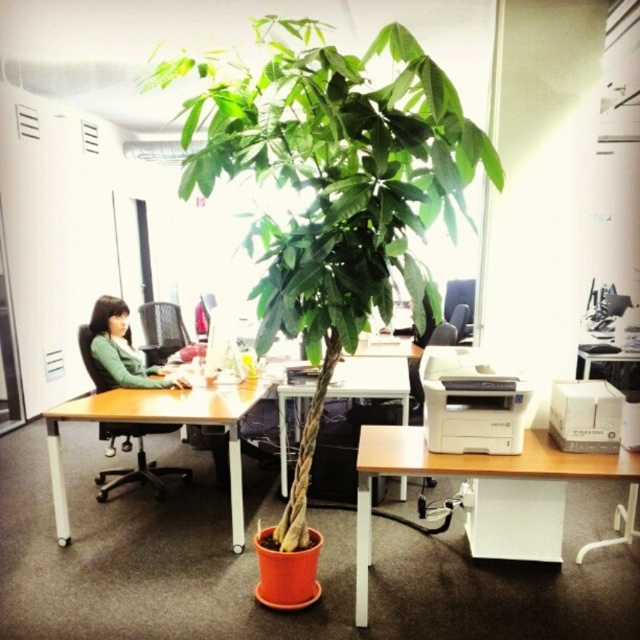
Who is more forward, [608,467] or [241,404]?

Point [608,467] is more forward.

Can you confirm if white plastic printer at lower center is wider than wooden table at center?

In fact, white plastic printer at lower center might be narrower than wooden table at center.

Is point (358, 579) farther from viewer compared to point (228, 474)?

No, it is not.

Where is `white plastic printer at lower center`? This screenshot has height=640, width=640. white plastic printer at lower center is located at coordinates (461, 476).

Is point (275, 122) positioned after point (90, 348)?

That is False.

Which is in front, point (440, 97) or point (99, 348)?

Point (440, 97) is more forward.

Identify the location of green leafy plant at center. The height and width of the screenshot is (640, 640). (332, 188).

Is the position of green leafy plant at center more distant than that of white matte printer at right?

No.

Measure the distance between green leafy plant at center and white matte printer at right.

The distance of green leafy plant at center from white matte printer at right is 27.06 inches.

The width and height of the screenshot is (640, 640). Identify the location of green leafy plant at center. (332, 188).